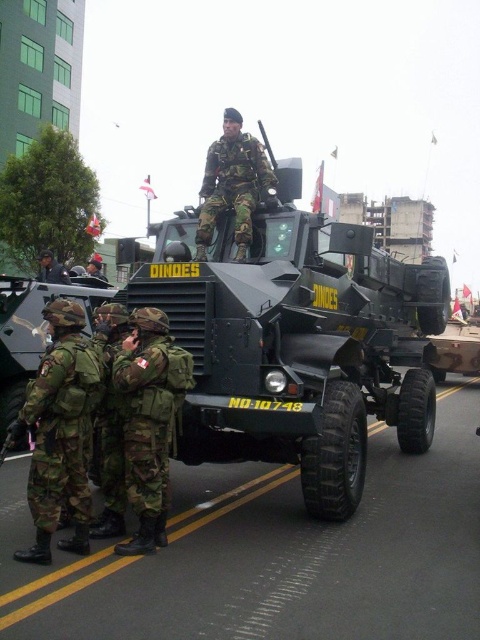
Question: Among these points, which one is farthest from the camera?

Choices:
 (A) (188, 397)
 (B) (16, 435)
 (C) (56, 262)

Answer: (C)

Question: Can you confirm if matte black helmet at center is thinner than camouflage uniform at center?

Choices:
 (A) yes
 (B) no

Answer: (B)

Question: Which point is farther from the camera taking this photo?

Choices:
 (A) (92, 408)
 (B) (98, 262)
 (C) (222, 154)
 (D) (9, 336)

Answer: (B)

Question: Which object is positioned closest to the matte black helmet at center?

Choices:
 (A) green matte armored vehicle at center
 (B) camouflage fabric uniform at left
 (C) camouflage uniform at center
 (D) camouflage fabric uniform at center

Answer: (A)

Question: Is matte black armored vehicle at center smaller than green matte armored vehicle at center?

Choices:
 (A) no
 (B) yes

Answer: (A)

Question: Is camouflage fabric uniform at left bigger than matte black helmet at center?

Choices:
 (A) yes
 (B) no

Answer: (B)